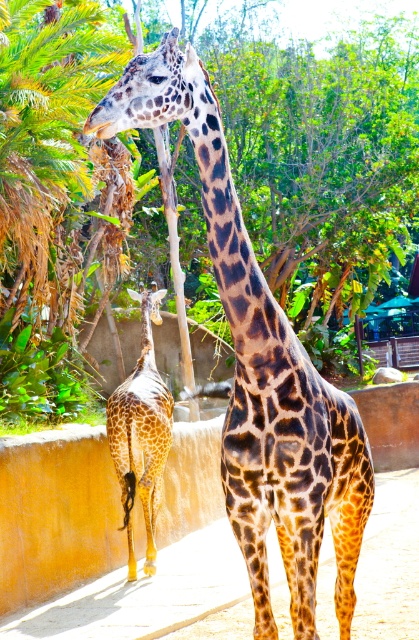
You are a zookeeper planning to install a new feeding platform for the spotted fur giraffe at lower left. The platform needs to be tall enough to reach the giraffe when it stretches its neck upwards. Considering the green leafy tree at upper left is much taller than the giraffe, would the platform need to be as tall as the tree?

The green leafy tree at upper left is much taller than the spotted fur giraffe at lower left, so the feeding platform does not need to be as tall as the tree. It should be designed to accommodate the giraffe when it stretches its neck, which is shorter than the tree.

You are a zookeeper trying to place two feeding stations for the giraffes. The first station should be placed at point (x=331, y=108) and the second at point (x=141, y=500). Which feeding station will be closer to the giraffes in the foreground?

The feeding station at point (x=141, y=500) is closer to the giraffes in the foreground because point (x=331, y=108) is behind it according to the spatial description.

You are a zookeeper planning to install a new feeding station for the giraffes. The feeding station must be placed at the same horizontal level as the green leafy tree at upper left. Where should you place the feeding station horizontally relative to the giraffes?

The feeding station should be placed at the horizontal position corresponding to the green leafy tree at upper left, which is at point 0.256 on the horizontal axis. This ensures it aligns with the tree horizontally.